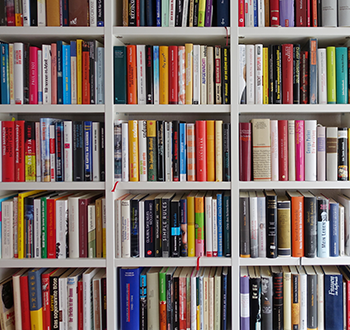
At what (x,y) coordinates should I click in order to perform the action: click on boards between shelves. Please return your answer as a coordinate pair (x, y). Looking at the image, I should click on (110, 299), (234, 300), (235, 227), (111, 226), (109, 143), (234, 143), (234, 72), (107, 70), (107, 14), (236, 15).